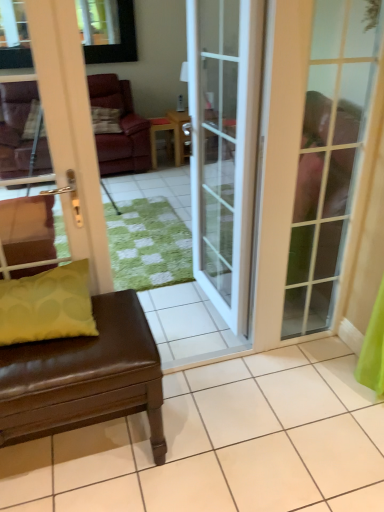
Question: Is white glossy door at left, the third door viewed from the right, oriented towards matte yellow pillow at lower left?

Choices:
 (A) yes
 (B) no

Answer: (A)

Question: Is white glossy door at left, the third door viewed from the right, with matte yellow pillow at lower left?

Choices:
 (A) yes
 (B) no

Answer: (B)

Question: Is white glossy door at left, the third door viewed from the right, at the right side of matte yellow pillow at lower left?

Choices:
 (A) yes
 (B) no

Answer: (B)

Question: Is white glossy door at left, which is the 1th door from left to right, turned away from matte yellow pillow at lower left?

Choices:
 (A) yes
 (B) no

Answer: (A)

Question: Would you consider white glossy door at left, which is the 1th door from left to right, to be distant from matte yellow pillow at lower left?

Choices:
 (A) no
 (B) yes

Answer: (A)

Question: From a real-world perspective, does white glossy door at left, the third door viewed from the right, stand above matte yellow pillow at lower left?

Choices:
 (A) no
 (B) yes

Answer: (B)

Question: Is white glass door at center, the second door viewed from the left, positioned with its back to matte glass door at right, positioned as the first door in right-to-left order?

Choices:
 (A) yes
 (B) no

Answer: (B)

Question: Is white glass door at center, the 2th door when ordered from right to left, aimed at matte glass door at right, positioned as the first door in right-to-left order?

Choices:
 (A) no
 (B) yes

Answer: (A)

Question: Is white glass door at center, the 2th door when ordered from right to left, smaller than matte glass door at right, positioned as the first door in right-to-left order?

Choices:
 (A) no
 (B) yes

Answer: (A)

Question: Is white glass door at center, the 2th door when ordered from right to left, positioned far away from matte glass door at right, positioned as the first door in right-to-left order?

Choices:
 (A) yes
 (B) no

Answer: (B)

Question: Considering the relative sizes of white glass door at center, the 2th door when ordered from right to left, and matte glass door at right, which appears as the third door when viewed from the left, in the image provided, is white glass door at center, the 2th door when ordered from right to left, shorter than matte glass door at right, which appears as the third door when viewed from the left,?

Choices:
 (A) no
 (B) yes

Answer: (A)

Question: From the image's perspective, is white glass door at center, the second door viewed from the left, over matte glass door at right, positioned as the first door in right-to-left order?

Choices:
 (A) yes
 (B) no

Answer: (A)

Question: From the image's perspective, would you say matte yellow pillow at lower left is shown under white glossy door at left, which is the 1th door from left to right?

Choices:
 (A) no
 (B) yes

Answer: (B)